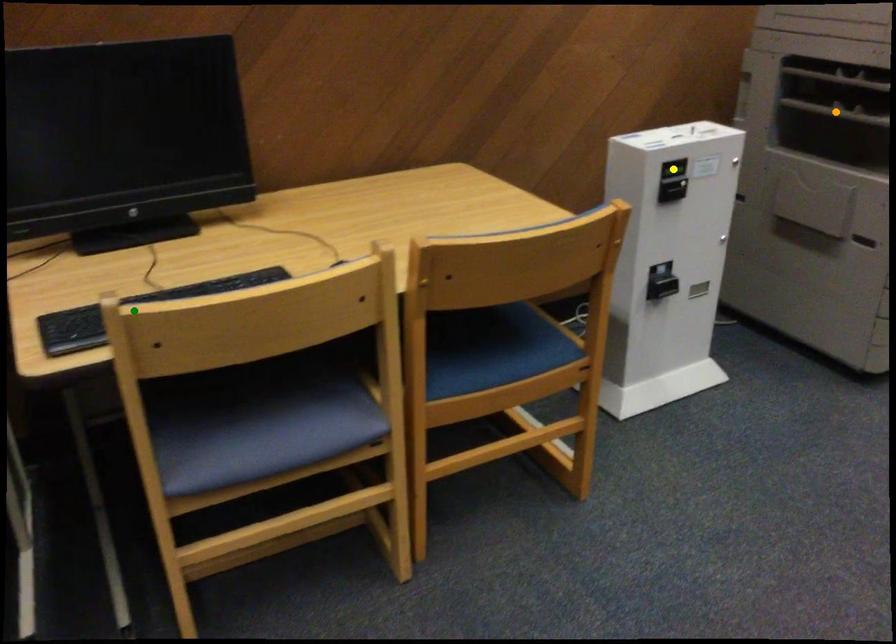
In the scene shown: Order these from nearest to farthest:
orange point
green point
yellow point

green point < yellow point < orange point